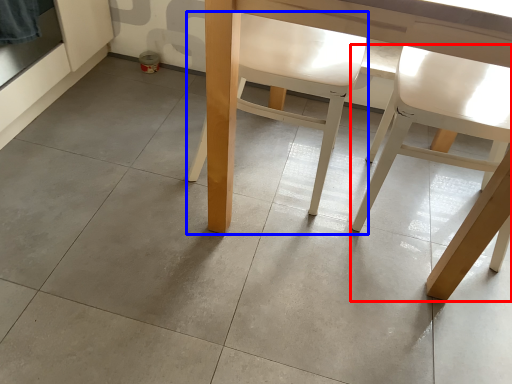
Question: Among these objects, which one is farthest to the camera, chair (highlighted by a red box) or chair (highlighted by a blue box)?

Choices:
 (A) chair
 (B) chair

Answer: (B)